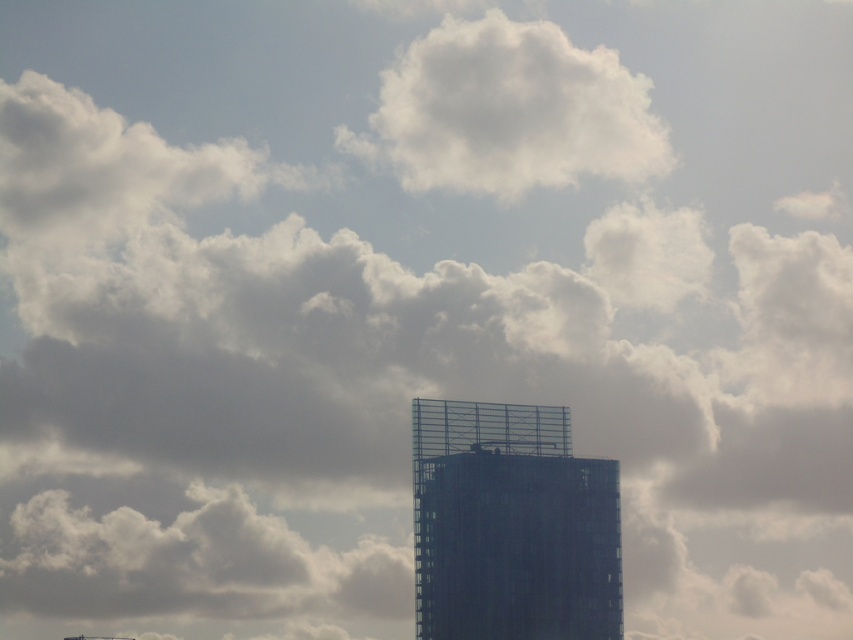
You are an architect evaluating the image of a modern building. You notice the transparent glass tower at center and the white fluffy cloud at upper center. Which object is taller in the image?

The transparent glass tower at center is taller than the white fluffy cloud at upper center in the image.

You are an architect observing the scene. You need to determine the relative positions of the transparent glass tower at center and the white fluffy cloud at upper center. Which object is positioned higher in the sky?

The white fluffy cloud at upper center is positioned higher in the sky than the transparent glass tower at center.

You are a drone operator trying to capture a photo of the transparent glass tower at center and the white fluffy cloud at upper center. Can you position your drone so that the tower is visible in front of the cloud?

Yes, because the transparent glass tower at center is in front of the white fluffy cloud at upper center, so positioning the drone to capture the tower against the cloud will show the tower in front.